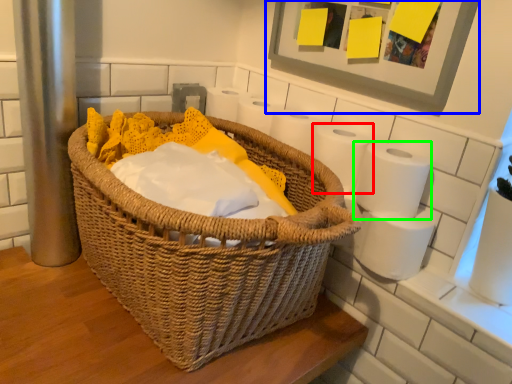
Question: Which is farther away from toilet paper (highlighted by a red box)? picture frame (highlighted by a blue box) or toilet paper (highlighted by a green box)?

Choices:
 (A) picture frame
 (B) toilet paper

Answer: (A)